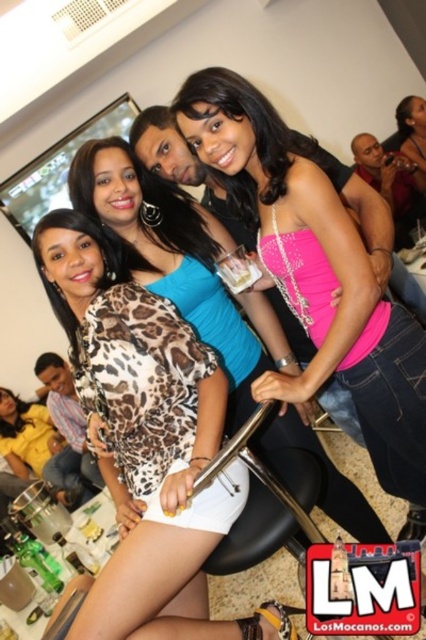
Question: Which of the following is the farthest from the observer?

Choices:
 (A) pink satin dress at center
 (B) clear plastic cup at center
 (C) leopard print blouse at center

Answer: (A)

Question: Which of the following is the farthest from the observer?

Choices:
 (A) (161, 336)
 (B) (411, 134)

Answer: (B)

Question: Does leopard print blouse at center lie behind pink satin tank top at center?

Choices:
 (A) no
 (B) yes

Answer: (A)

Question: Can you confirm if leopard print blouse at center is positioned below pink satin dress at center?

Choices:
 (A) yes
 (B) no

Answer: (A)

Question: Is pink satin dress at center above clear plastic cup at center?

Choices:
 (A) no
 (B) yes

Answer: (B)

Question: Which object is closer to the camera taking this photo?

Choices:
 (A) clear plastic cup at center
 (B) leopard print blouse at center
 (C) pink satin tank top at center

Answer: (B)